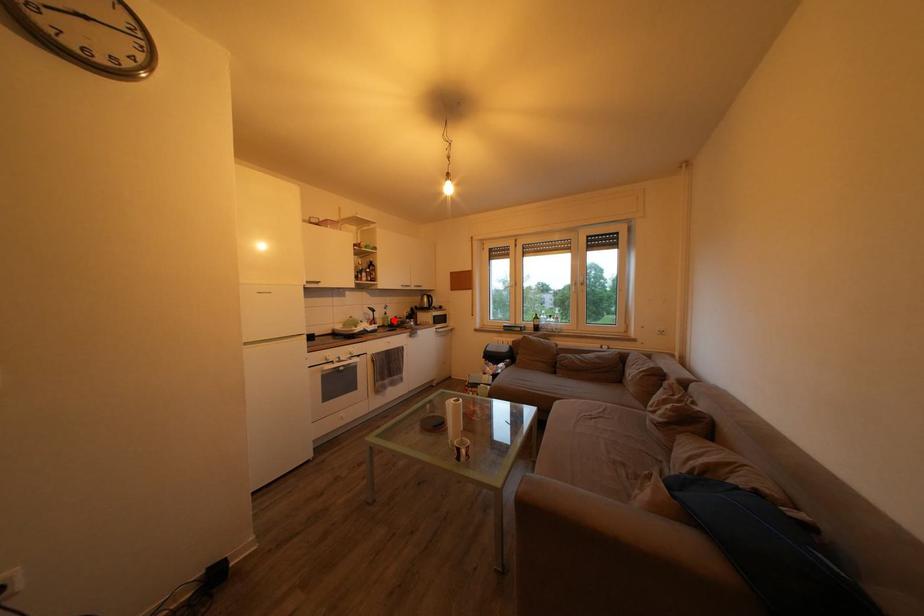
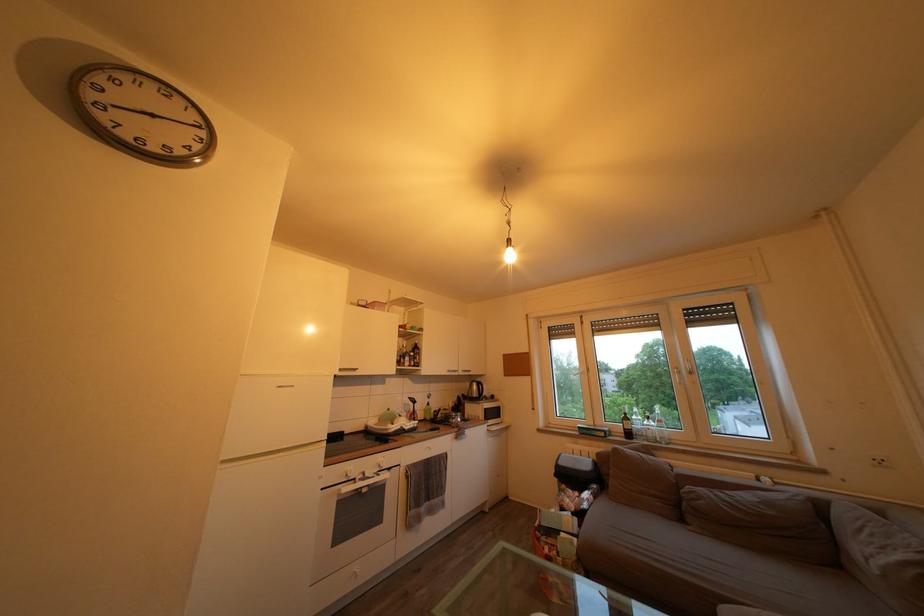
Question: I am providing you with two images of the same scene from different viewpoints. Given a red point in image1, look at the same physical point in image2. Is it:

Choices:
 (A) Closer to the viewpoint
 (B) Farther from the viewpoint

Answer: (B)